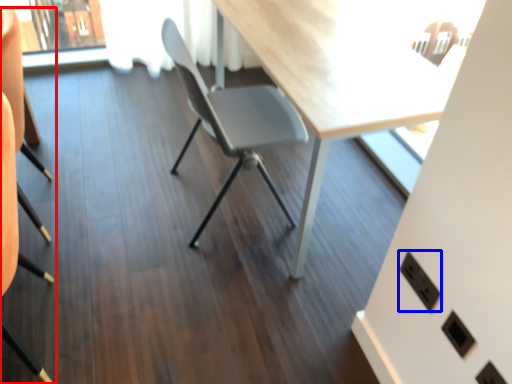
Question: Which of the following is the closest to the observer, chair (highlighted by a red box) or electric outlet (highlighted by a blue box)?

Choices:
 (A) chair
 (B) electric outlet

Answer: (A)